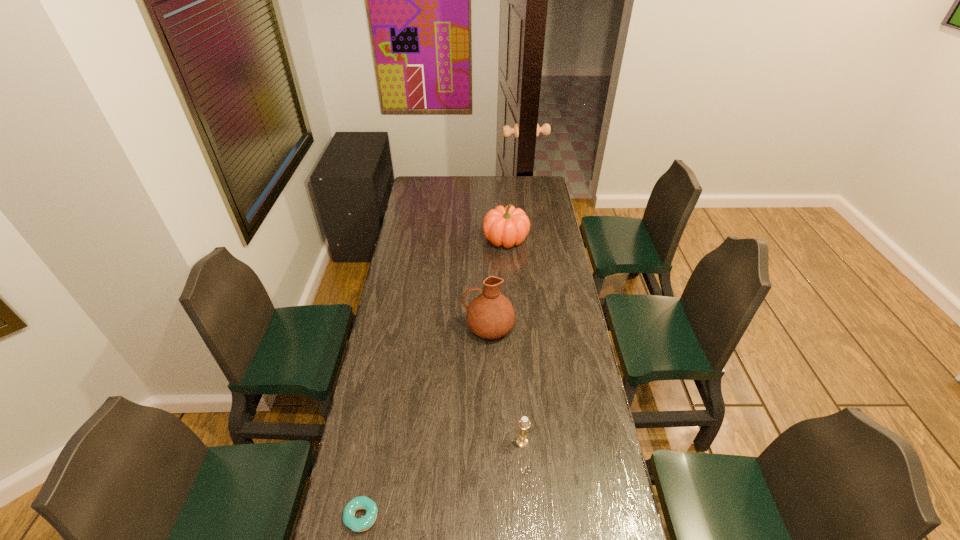
This screenshot has height=540, width=960. Identify the location of vacant space that's between the third farthest object and the pitcher. (506, 384).

The height and width of the screenshot is (540, 960). I want to click on free spot between the shortest object and the pumpkin, so click(x=434, y=377).

At what (x,y) coordinates should I click in order to perform the action: click on free spot between the second tallest object and the nearest object. Please return your answer as a coordinate pair (x, y). Looking at the image, I should click on (434, 377).

The width and height of the screenshot is (960, 540). Find the location of `free spot between the pitcher and the nearest object`. free spot between the pitcher and the nearest object is located at coordinates (425, 422).

Find the location of a particular element. The image size is (960, 540). vacant region between the third nearest object and the leftmost object is located at coordinates (425, 422).

Where is `object that can be found as the third closest to the nearest object`? This screenshot has height=540, width=960. object that can be found as the third closest to the nearest object is located at coordinates (508, 226).

Locate an element on the screen. Image resolution: width=960 pixels, height=540 pixels. the closest object to the shortest object is located at coordinates (524, 424).

Locate an element on the screen. vacant space that satisfies the following two spatial constraints: 1. on the back side of the third farthest object; 2. on the side of the pitcher with the handle is located at coordinates (514, 327).

Locate an element on the screen. vacant area in the image that satisfies the following two spatial constraints: 1. on the side of the second nearest object with the handle; 2. on the right side of the second farthest object is located at coordinates (x=492, y=442).

Locate an element on the screen. Image resolution: width=960 pixels, height=540 pixels. vacant region that satisfies the following two spatial constraints: 1. on the side of the pitcher with the handle; 2. on the left side of the second shortest object is located at coordinates (492, 442).